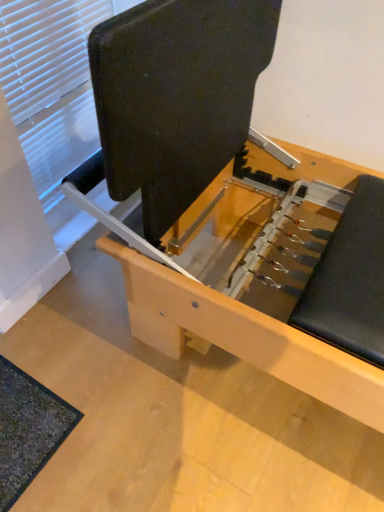
Question: Choose the correct answer: Is matte black bench at center inside dark green textured mat at lower left or outside it?

Choices:
 (A) inside
 (B) outside

Answer: (B)

Question: In the image, is matte black bench at center on the left side or the right side of dark green textured mat at lower left?

Choices:
 (A) left
 (B) right

Answer: (B)

Question: Estimate the real-world distances between objects in this image. Which object is closer to the matte black bench at center?

Choices:
 (A) dark green textured mat at lower left
 (B) white matte window at upper left

Answer: (B)

Question: Based on their relative distances, which object is nearer to the matte black bench at center?

Choices:
 (A) white matte window at upper left
 (B) dark green textured mat at lower left

Answer: (A)